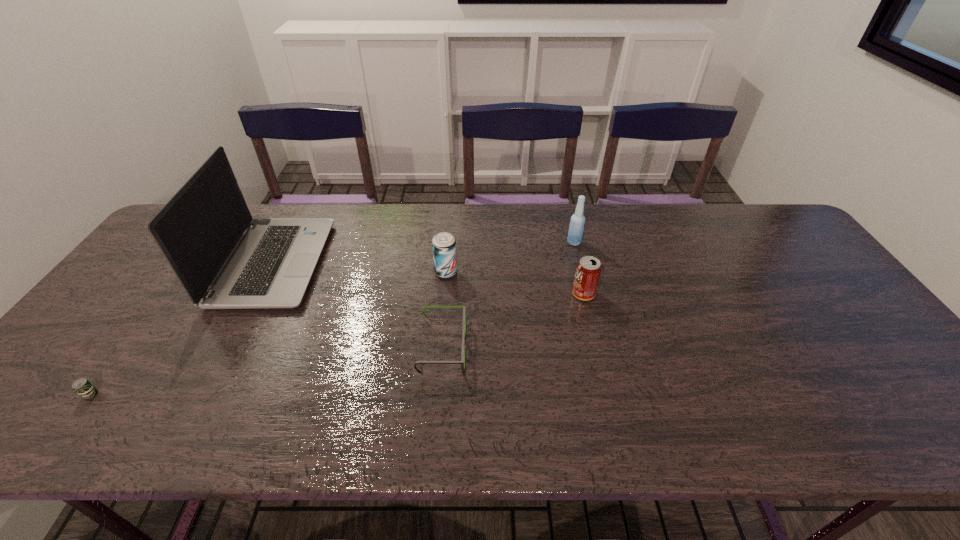
You are a GUI agent. You are given a task and a screenshot of the screen. Output one action in this format:
    pyautogui.click(x=<x>, y=<y>)
    Task: Click on the laptop computer
    The height and width of the screenshot is (540, 960).
    Given the screenshot: What is the action you would take?
    pyautogui.click(x=224, y=259)

You are a GUI agent. You are given a task and a screenshot of the screen. Output one action in this format:
    pyautogui.click(x=<x>, y=<y>)
    Task: Click on the tallest object
    The image size is (960, 540).
    Given the screenshot: What is the action you would take?
    pyautogui.click(x=224, y=259)

The height and width of the screenshot is (540, 960). I want to click on the second tallest object, so click(x=575, y=233).

The width and height of the screenshot is (960, 540). What are the coordinates of `the farther beer can` in the screenshot? It's located at (443, 244).

In order to click on the right beer can in this screenshot , I will do `click(443, 244)`.

What are the coordinates of `soda can` in the screenshot? It's located at (588, 270).

You are a GUI agent. You are given a task and a screenshot of the screen. Output one action in this format:
    pyautogui.click(x=<x>, y=<y>)
    Task: Click on the fifth tallest object
    
    Given the screenshot: What is the action you would take?
    (462, 362)

Locate an element on the screen. This screenshot has height=540, width=960. the fifth farthest object is located at coordinates (462, 362).

Locate an element on the screen. This screenshot has width=960, height=540. the nearest object is located at coordinates (82, 386).

Locate an element on the screen. This screenshot has width=960, height=540. the leftmost object is located at coordinates (82, 386).